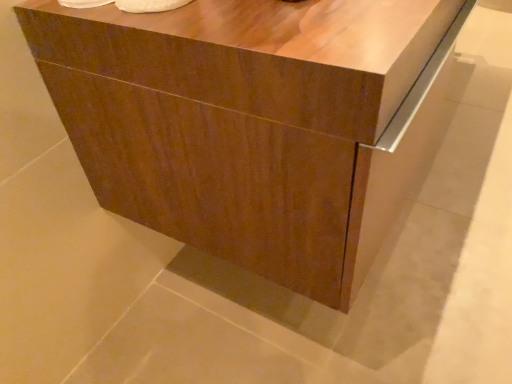
Question: Should I look upward or downward to see matte wood chest of drawers at center?

Choices:
 (A) down
 (B) up

Answer: (B)